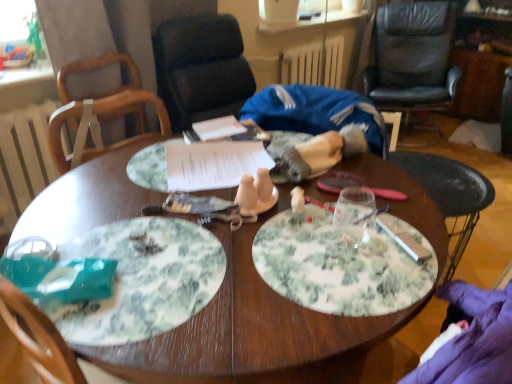
The width and height of the screenshot is (512, 384). What are the coordinates of `unoccupied area in front of white crumbly food at center` in the screenshot? It's located at (141, 297).